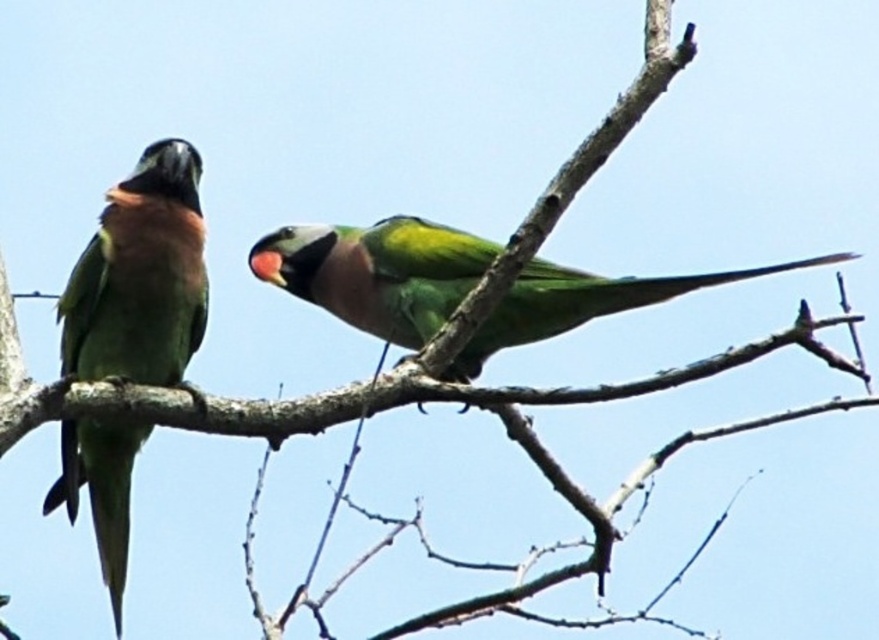
Question: Among these points, which one is farthest from the camera?

Choices:
 (A) (834, 256)
 (B) (120, 333)

Answer: (B)

Question: Is green matte parrot at left to the right of green matte parrot at center from the viewer's perspective?

Choices:
 (A) no
 (B) yes

Answer: (A)

Question: Which point is farther from the camera taking this photo?

Choices:
 (A) (426, 227)
 (B) (158, 189)

Answer: (A)

Question: Observing the image, what is the correct spatial positioning of green matte parrot at left in reference to green matte parrot at center?

Choices:
 (A) left
 (B) right

Answer: (A)

Question: In this image, where is green matte parrot at left located relative to green matte parrot at center?

Choices:
 (A) below
 (B) above

Answer: (A)